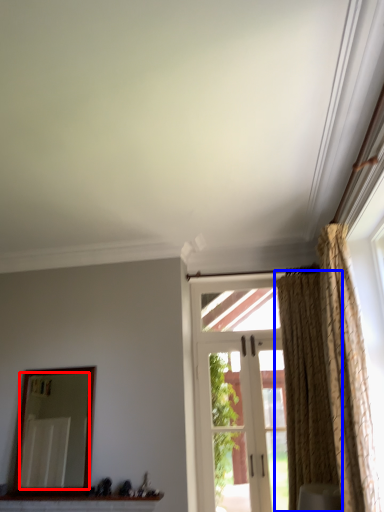
Question: Which point is further to the camera, mirror (highlighted by a red box) or curtain (highlighted by a blue box)?

Choices:
 (A) mirror
 (B) curtain

Answer: (A)